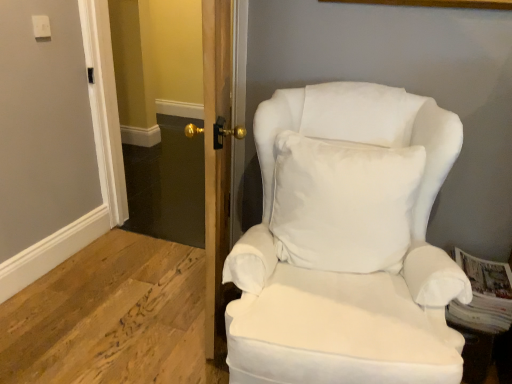
Question: From a real-world perspective, is white fabric chair at right on clear glass door at center?

Choices:
 (A) no
 (B) yes

Answer: (A)

Question: Is white fabric chair at right closer to camera compared to clear glass door at center?

Choices:
 (A) yes
 (B) no

Answer: (A)

Question: Can you confirm if white fabric chair at right is thinner than clear glass door at center?

Choices:
 (A) no
 (B) yes

Answer: (A)

Question: Is white fabric chair at right not near clear glass door at center?

Choices:
 (A) no
 (B) yes

Answer: (B)

Question: Is white fabric chair at right to the right of clear glass door at center from the viewer's perspective?

Choices:
 (A) yes
 (B) no

Answer: (A)

Question: Is white fabric chair at right aimed at clear glass door at center?

Choices:
 (A) yes
 (B) no

Answer: (B)

Question: Can you confirm if wooden door at center is wider than white fabric chair at right?

Choices:
 (A) yes
 (B) no

Answer: (B)

Question: Considering the relative positions of wooden door at center and white fabric chair at right in the image provided, is wooden door at center to the right of white fabric chair at right from the viewer's perspective?

Choices:
 (A) no
 (B) yes

Answer: (A)

Question: Is wooden door at center at the left side of white fabric chair at right?

Choices:
 (A) yes
 (B) no

Answer: (A)

Question: Is wooden door at center thinner than white fabric chair at right?

Choices:
 (A) no
 (B) yes

Answer: (B)

Question: Is wooden door at center directly adjacent to white fabric chair at right?

Choices:
 (A) no
 (B) yes

Answer: (A)

Question: Considering the relative sizes of wooden door at center and white fabric chair at right in the image provided, is wooden door at center shorter than white fabric chair at right?

Choices:
 (A) no
 (B) yes

Answer: (A)

Question: Is wooden door at center looking in the opposite direction of white soft cushion at center?

Choices:
 (A) yes
 (B) no

Answer: (A)